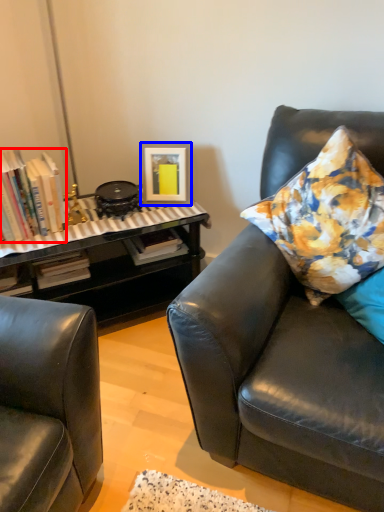
Question: Which point is further to the camera, book (highlighted by a red box) or picture frame (highlighted by a blue box)?

Choices:
 (A) book
 (B) picture frame

Answer: (B)